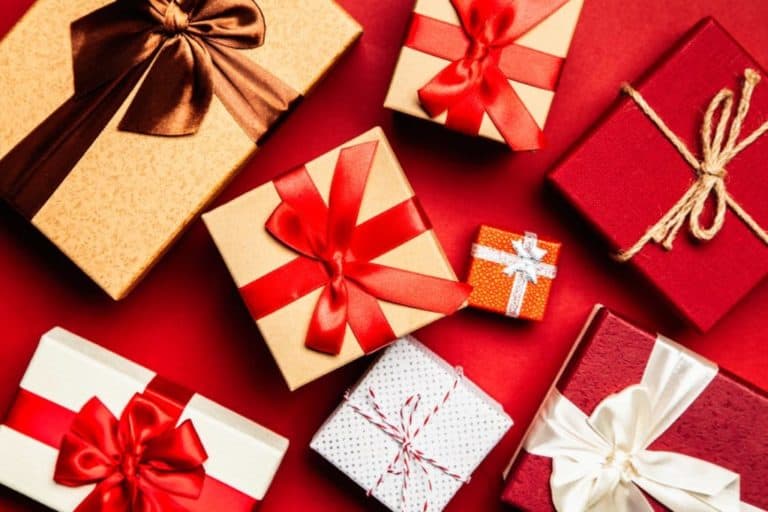
Find the location of `presents with bows`. presents with bows is located at coordinates (131, 455), (404, 442), (624, 442), (697, 178), (510, 262), (365, 258), (491, 58), (131, 52).